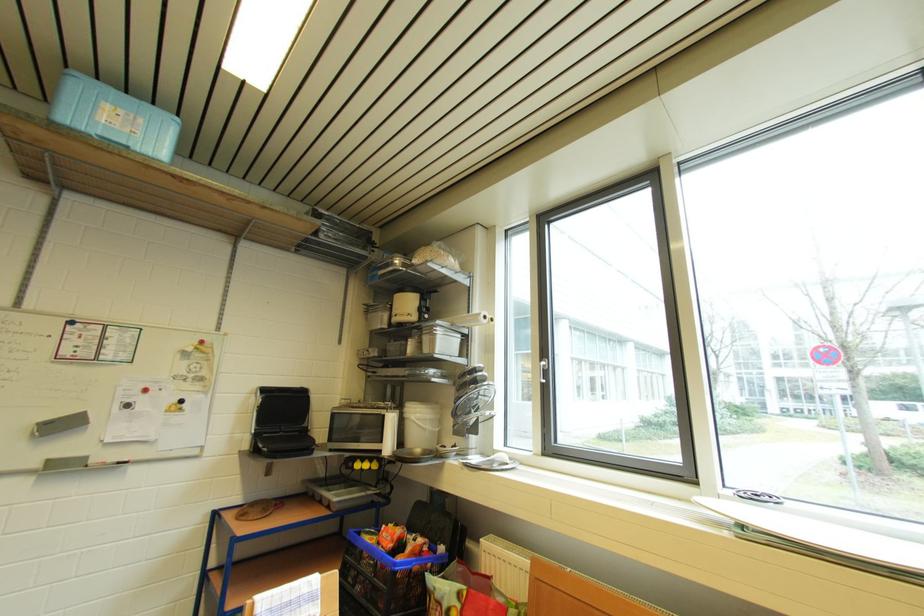
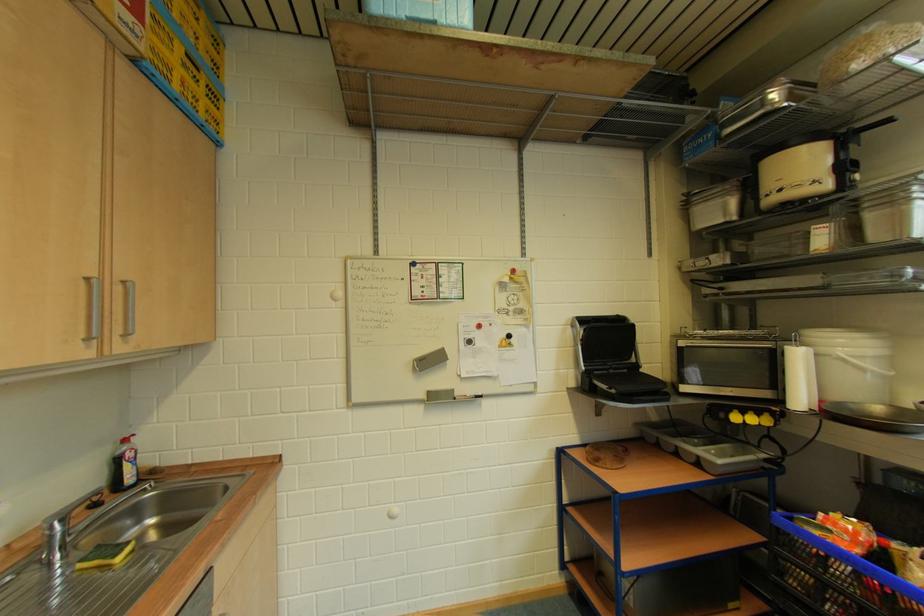
The point at (416, 540) is marked in the first image. Where is the corresponding point in the second image?

(905, 549)